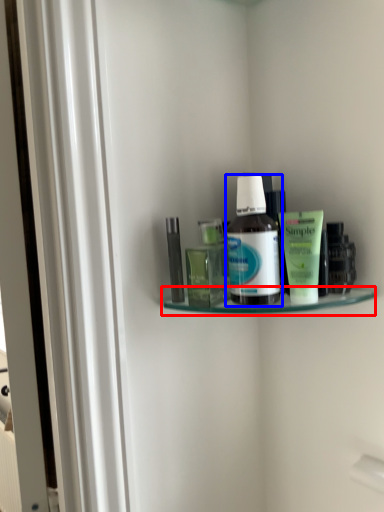
Question: Which object appears closest to the camera in this image, shelf (highlighted by a red box) or bottle (highlighted by a blue box)?

Choices:
 (A) shelf
 (B) bottle

Answer: (A)